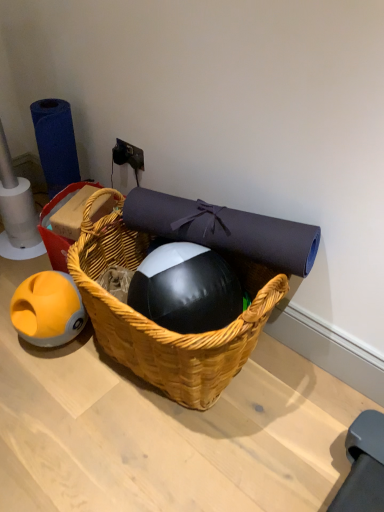
Question: In terms of width, does woven wood basket at center look wider or thinner when compared to blue matte roll of toilet paper at left?

Choices:
 (A) thin
 (B) wide

Answer: (B)

Question: Would you say woven wood basket at center is inside or outside blue matte roll of toilet paper at left?

Choices:
 (A) inside
 (B) outside

Answer: (B)

Question: Considering the real-world distances, which object is closest to the blue matte roll of toilet paper at left?

Choices:
 (A) woven wood picnic basket at center
 (B) woven wood basket at center

Answer: (B)

Question: Considering the real-world distances, which object is farthest from the blue matte roll of toilet paper at left?

Choices:
 (A) woven wood picnic basket at center
 (B) woven wood basket at center

Answer: (A)